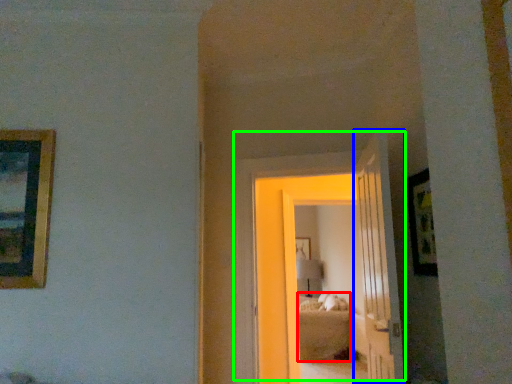
Question: Which is farther away from bed (highlighted by a red box)? door (highlighted by a blue box) or door (highlighted by a green box)?

Choices:
 (A) door
 (B) door

Answer: (A)